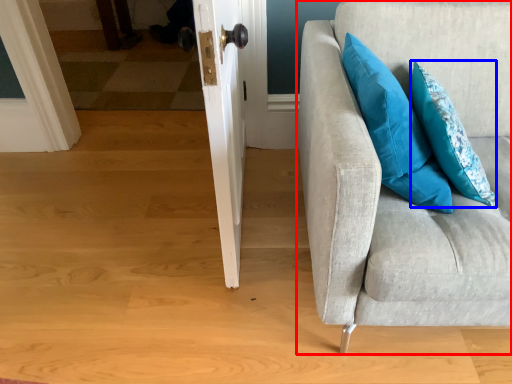
Question: Which of the following is the farthest to the observer, studio couch (highlighted by a red box) or pillow (highlighted by a blue box)?

Choices:
 (A) studio couch
 (B) pillow

Answer: (B)